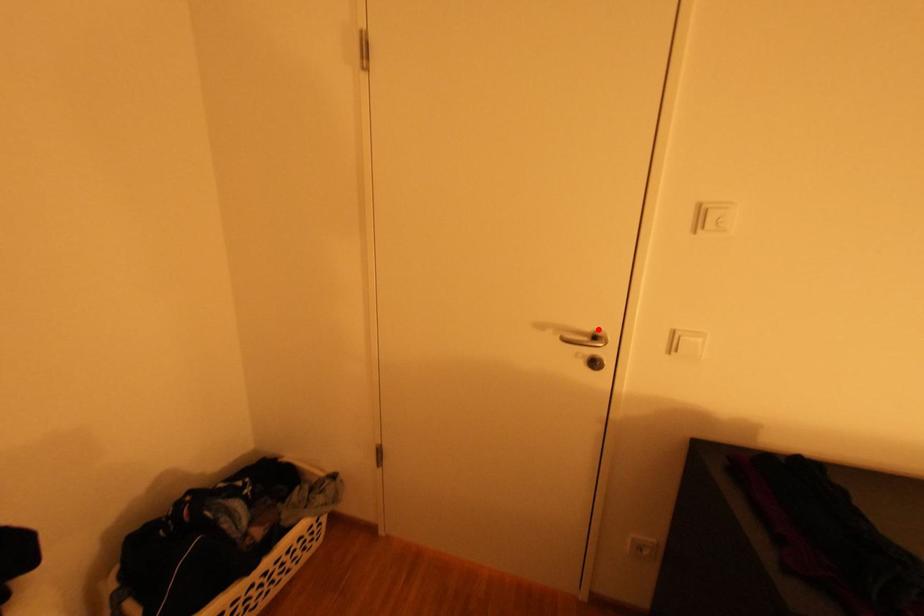
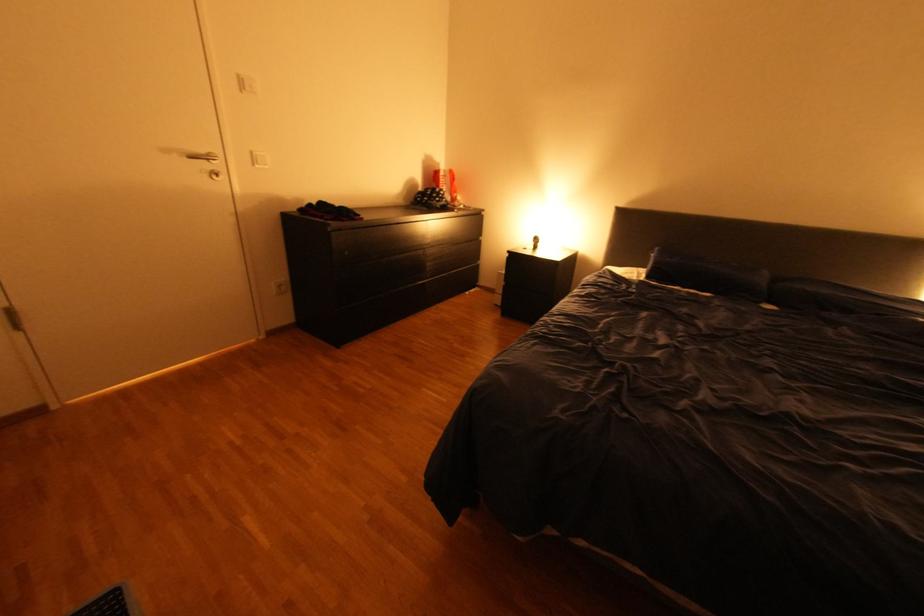
The point at the highlighted location is marked in the first image. Where is the corresponding point in the second image?

(213, 151)